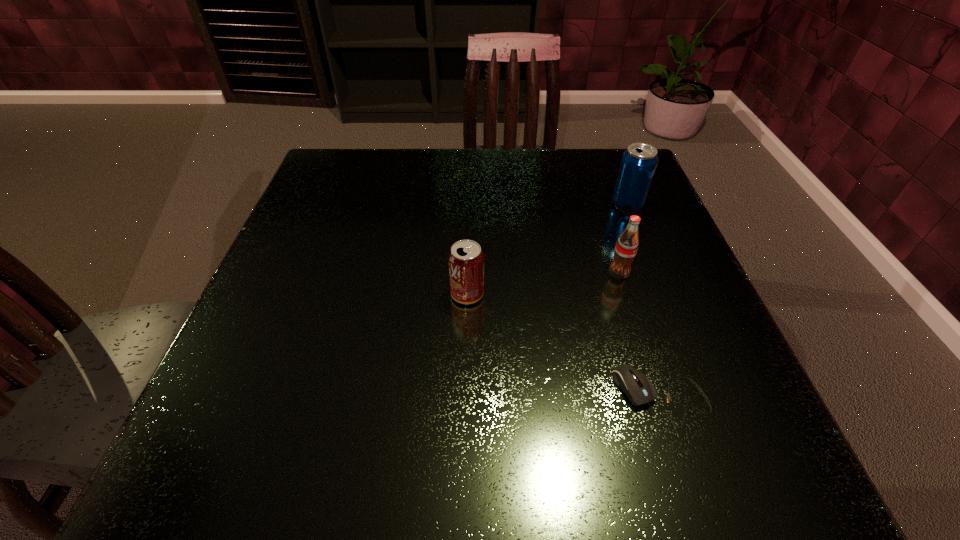
Where is `blank area located 0.260m on the right of the second nearest object`? Image resolution: width=960 pixels, height=540 pixels. blank area located 0.260m on the right of the second nearest object is located at coordinates (631, 294).

Find the location of a particular element. free location located 0.170m on the back of the computer mouse is located at coordinates (626, 287).

Identify the location of object situated at the far edge. (637, 168).

Image resolution: width=960 pixels, height=540 pixels. I want to click on object present at the near edge, so click(638, 388).

I want to click on computer mouse located at the right edge, so click(638, 388).

Image resolution: width=960 pixels, height=540 pixels. I want to click on object that is at the far right corner, so click(637, 168).

Image resolution: width=960 pixels, height=540 pixels. In order to click on object positioned at the near right corner in this screenshot , I will do `click(638, 388)`.

Where is `vacant space at the far edge`? vacant space at the far edge is located at coordinates (439, 160).

Image resolution: width=960 pixels, height=540 pixels. In the image, there is a desktop. In order to click on vacant space at the near edge in this screenshot , I will do `click(396, 436)`.

Locate an element on the screen. This screenshot has height=540, width=960. free space at the left edge is located at coordinates (278, 346).